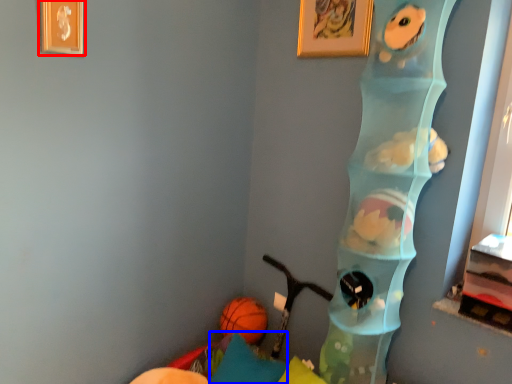
Question: Which point is closer to the camera, picture frame (highlighted by a red box) or pillow (highlighted by a blue box)?

Choices:
 (A) picture frame
 (B) pillow

Answer: (A)